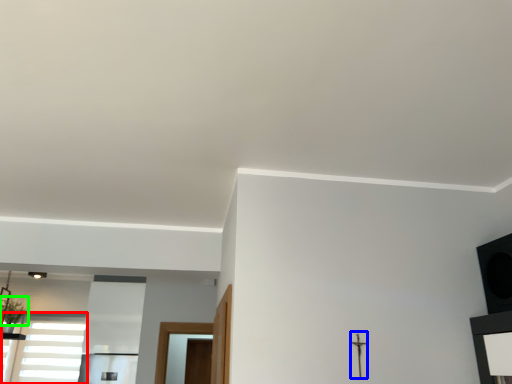
Question: Considering the real-world distances, which object is closest to window (highlighted by a red box)? crucifix (highlighted by a blue box) or plant (highlighted by a green box).

Choices:
 (A) crucifix
 (B) plant

Answer: (B)